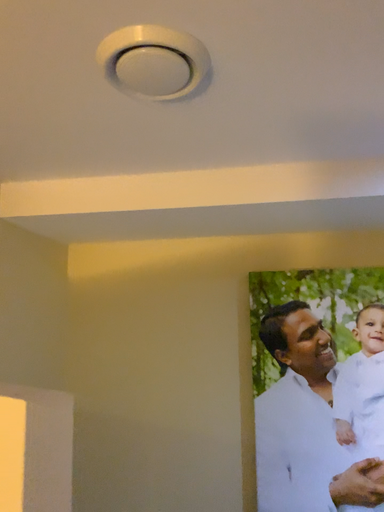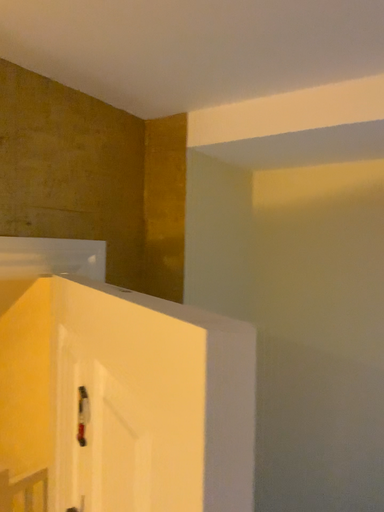
Question: Which way did the camera rotate in the video?

Choices:
 (A) rotated left
 (B) rotated right

Answer: (A)